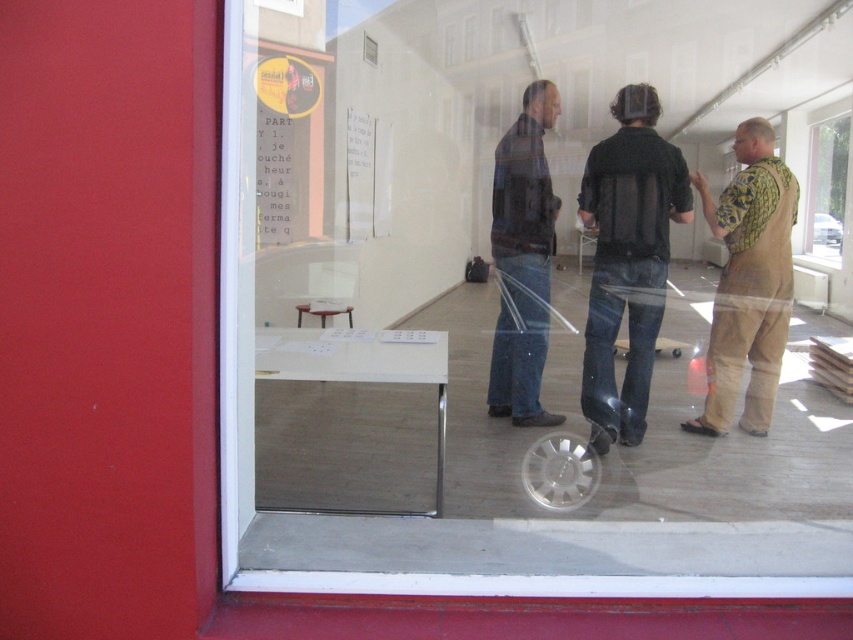
You are an interior designer assessing the layout of this art gallery. You notice the camouflage shirt at right and the dark blue jeans at center. Which object takes up more horizontal space in the scene?

The camouflage shirt at right takes up more horizontal space in the scene because its width is larger than that of the dark blue jeans at center.

Please provide the coordinates of the black matte vest at center in the image. The coordinates should be in the format of a pair of numbers separated by a comma, enclosed in parentheses.

The coordinates of the black matte vest at center are at point [627,259].